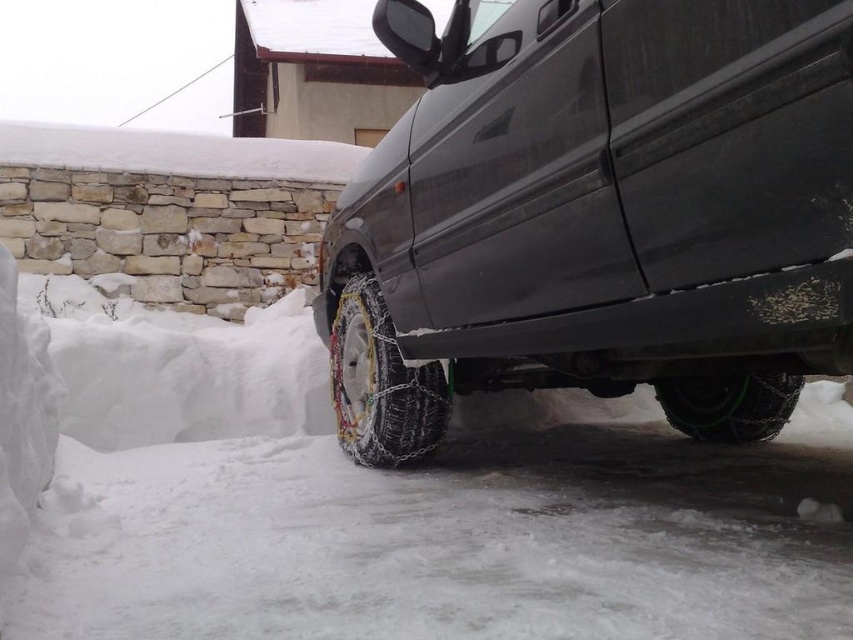
You are standing at the origin point of the image. You need to walk to point B which is located at point (379,467). However, there is an obstacle at point A located at point (839,291). Can you safely walk around the obstacle to reach point B without getting too close?

Point (839,291) is in front of point (379,467), so you can walk around the obstacle at point (839,291) by going behind it to reach point B safely.

You are a delivery driver who needs to check if your matte black van at center can fit through a narrow alley that is only wide enough for vehicles smaller than the green rubber tire at lower right. Based on the scene, can your van fit through the alley?

The matte black van at center is bigger than the green rubber tire at lower right. Since the alley is only wide enough for vehicles smaller than the green rubber tire at lower right, the matte black van at center cannot fit through the alley.